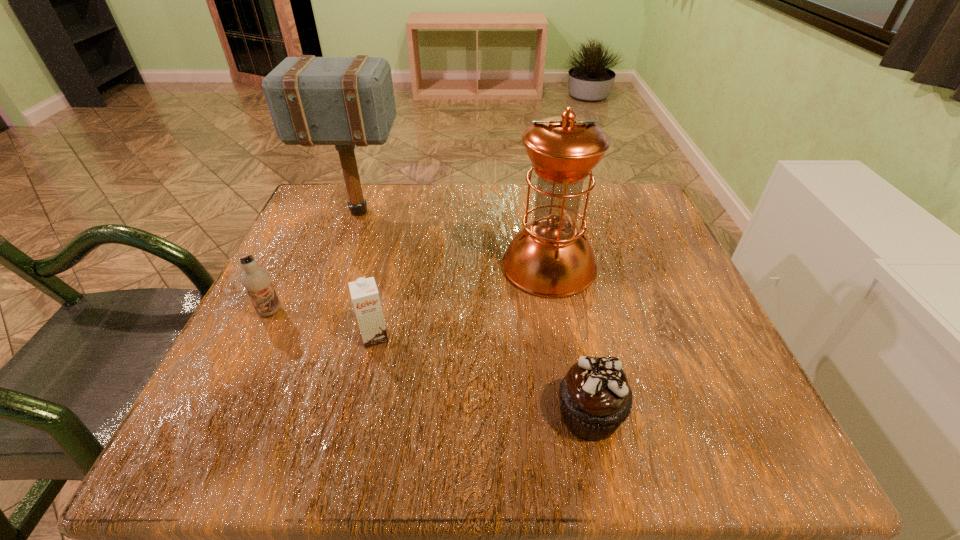
In the image, there is a desktop. Where is `vacant space at the near edge`? vacant space at the near edge is located at coordinates (468, 411).

Where is `vacant space at the right edge of the desktop`? This screenshot has width=960, height=540. vacant space at the right edge of the desktop is located at coordinates (739, 390).

The image size is (960, 540). Find the location of `vacant area at the far left corner of the desktop`. vacant area at the far left corner of the desktop is located at coordinates (345, 206).

Identify the location of vacant region at the near left corner of the desktop. (282, 421).

Image resolution: width=960 pixels, height=540 pixels. I want to click on free space at the near right corner of the desktop, so click(767, 461).

You are a GUI agent. You are given a task and a screenshot of the screen. Output one action in this format:
    pyautogui.click(x=<x>, y=<y>)
    Task: Click on the vacant space that's between the second nearest object and the left chocolate milk
    
    Given the screenshot: What is the action you would take?
    pyautogui.click(x=323, y=324)

Locate an element on the screen. free space between the farther chocolate milk and the oil lamp is located at coordinates (410, 288).

Locate an element on the screen. This screenshot has width=960, height=540. blank region between the right chocolate milk and the farther chocolate milk is located at coordinates (323, 324).

Find the location of a particular element. This screenshot has width=960, height=540. vacant space that's between the oil lamp and the second nearest object is located at coordinates (462, 301).

Find the location of a particular element. The width and height of the screenshot is (960, 540). vacant space in between the farthest object and the second farthest object is located at coordinates (453, 239).